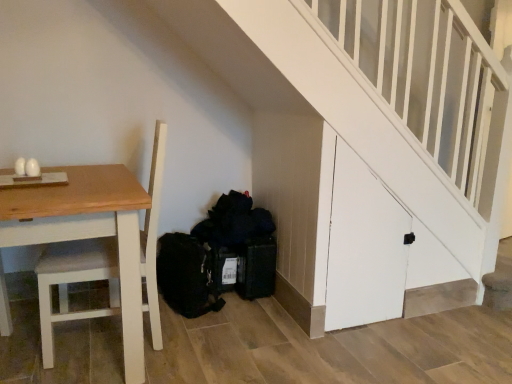
What is the approximate width of wooden table at left?

It is 25.34 inches.

What do you see at coordinates (87, 229) in the screenshot? I see `wooden table at left` at bounding box center [87, 229].

Identify the location of wooden table at left. The height and width of the screenshot is (384, 512). (87, 229).

Locate an element on the screen. wooden table at left is located at coordinates (87, 229).